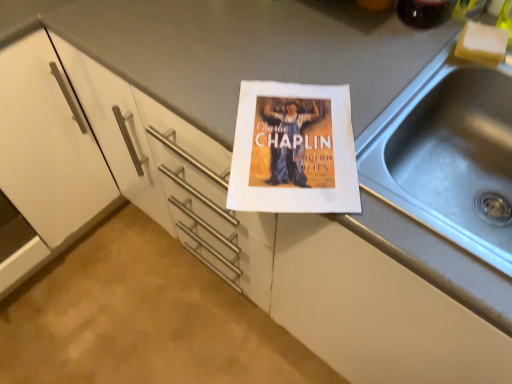
Question: Is white sponge at upper right located within translucent glass beverage at upper right?

Choices:
 (A) no
 (B) yes

Answer: (A)

Question: Does translucent glass beverage at upper right have a smaller size compared to white sponge at upper right?

Choices:
 (A) no
 (B) yes

Answer: (A)

Question: Is the depth of translucent glass beverage at upper right less than that of white sponge at upper right?

Choices:
 (A) yes
 (B) no

Answer: (A)

Question: Is translucent glass beverage at upper right positioned with its back to white sponge at upper right?

Choices:
 (A) no
 (B) yes

Answer: (A)

Question: Can you confirm if translucent glass beverage at upper right is bigger than white sponge at upper right?

Choices:
 (A) yes
 (B) no

Answer: (A)

Question: Is point (458, 100) positioned closer to the camera than point (492, 39)?

Choices:
 (A) farther
 (B) closer

Answer: (A)

Question: From a real-world perspective, is silver metallic sink at right positioned above or below white sponge at upper right?

Choices:
 (A) above
 (B) below

Answer: (B)

Question: From the image's perspective, is silver metallic sink at right above or below white sponge at upper right?

Choices:
 (A) above
 (B) below

Answer: (B)

Question: Considering their positions, is silver metallic sink at right located in front of or behind white sponge at upper right?

Choices:
 (A) front
 (B) behind

Answer: (A)

Question: From a real-world perspective, relative to translucent glass beverage at upper right, is silver metallic sink at right vertically above or below?

Choices:
 (A) above
 (B) below

Answer: (B)

Question: Is silver metallic sink at right taller or shorter than translucent glass beverage at upper right?

Choices:
 (A) tall
 (B) short

Answer: (B)

Question: Is silver metallic sink at right bigger or smaller than translucent glass beverage at upper right?

Choices:
 (A) big
 (B) small

Answer: (A)

Question: Considering their positions, is silver metallic sink at right located in front of or behind translucent glass beverage at upper right?

Choices:
 (A) behind
 (B) front

Answer: (B)

Question: Considering the positions of translucent glass beverage at upper right and white sponge at upper right in the image, is translucent glass beverage at upper right bigger or smaller than white sponge at upper right?

Choices:
 (A) small
 (B) big

Answer: (B)

Question: Considering the positions of translucent glass beverage at upper right and white sponge at upper right in the image, is translucent glass beverage at upper right wider or thinner than white sponge at upper right?

Choices:
 (A) wide
 (B) thin

Answer: (A)